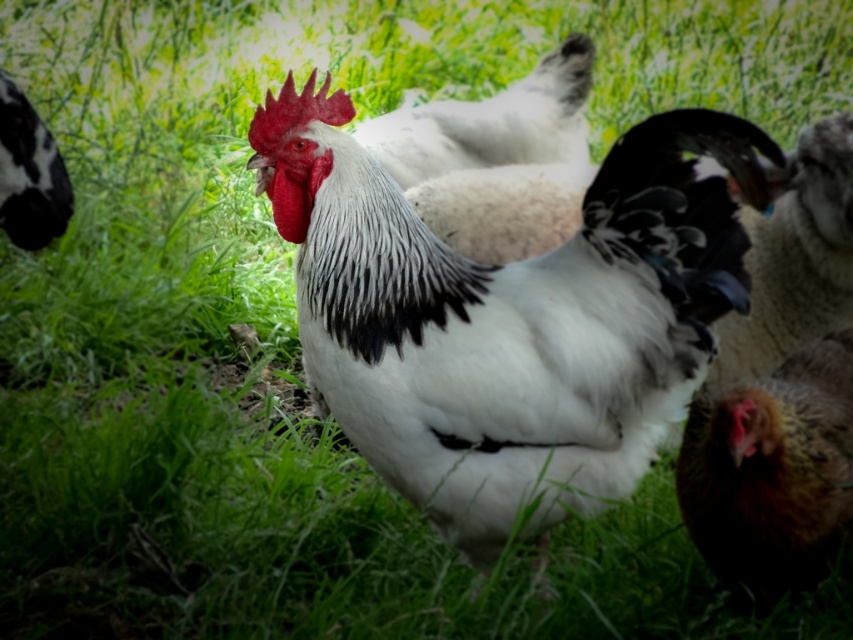
Who is positioned more to the right, brown speckled feather at lower right or white fluffy chicken at center?

brown speckled feather at lower right

Can you confirm if brown speckled feather at lower right is wider than white fluffy chicken at center?

No, brown speckled feather at lower right is not wider than white fluffy chicken at center.

At what (x,y) coordinates should I click in order to perform the action: click on brown speckled feather at lower right. Please return your answer as a coordinate pair (x, y). The width and height of the screenshot is (853, 640). Looking at the image, I should click on (772, 472).

Does point (476, 426) come in front of point (437, 128)?

Yes, it is in front of point (437, 128).

Locate an element on the screen. white fluffy rooster at center is located at coordinates (508, 316).

Between white fluffy rooster at center and brown speckled feather at lower right, which one appears on the right side from the viewer's perspective?

brown speckled feather at lower right

Is white fluffy rooster at center thinner than brown speckled feather at lower right?

No.

You are a GUI agent. You are given a task and a screenshot of the screen. Output one action in this format:
    pyautogui.click(x=<x>, y=<y>)
    Task: Click on the white fluffy rooster at center
    Image resolution: width=853 pixels, height=640 pixels.
    Given the screenshot: What is the action you would take?
    pyautogui.click(x=508, y=316)

Find the location of `white fluffy rooster at center`. white fluffy rooster at center is located at coordinates click(508, 316).